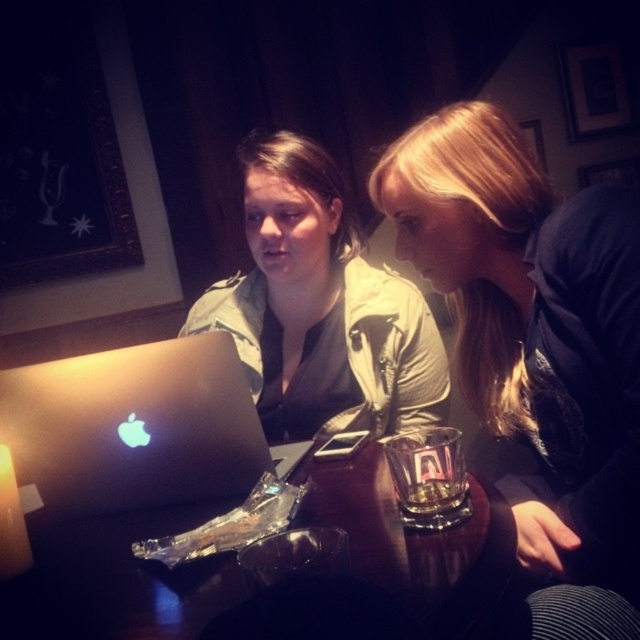
Which is below, blonde hair at upper right or black matte laptop at center?

Positioned lower is black matte laptop at center.

Does blonde hair at upper right have a greater width compared to black matte laptop at center?

In fact, blonde hair at upper right might be narrower than black matte laptop at center.

Is point (611, 330) positioned after point (209, 458)?

No, (611, 330) is closer to viewer.

Where is `blonde hair at upper right`? This screenshot has height=640, width=640. blonde hair at upper right is located at coordinates (532, 326).

Is point (60, 632) more distant than point (32, 406)?

No, (60, 632) is in front of (32, 406).

How distant is wooden table at center from black matte laptop at center?

6.20 inches

The image size is (640, 640). I want to click on wooden table at center, so pyautogui.click(x=116, y=580).

I want to click on wooden table at center, so click(116, 580).

Where is `matte khaki jacket at center`? This screenshot has height=640, width=640. matte khaki jacket at center is located at coordinates (321, 307).

The height and width of the screenshot is (640, 640). Describe the element at coordinates (321, 307) in the screenshot. I see `matte khaki jacket at center` at that location.

Locate an element on the screen. The width and height of the screenshot is (640, 640). matte khaki jacket at center is located at coordinates (321, 307).

I want to click on matte khaki jacket at center, so click(321, 307).